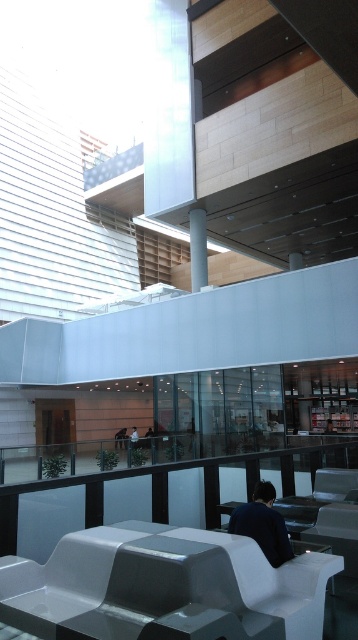
Question: Can you confirm if white glossy pillar at upper center is thinner than white fabric person at center?

Choices:
 (A) no
 (B) yes

Answer: (B)

Question: Is white glossy pillar at upper center positioned in front of white fabric person at center?

Choices:
 (A) no
 (B) yes

Answer: (A)

Question: Does white glossy pillar at upper center appear over white fabric person at center?

Choices:
 (A) no
 (B) yes

Answer: (B)

Question: Which point is closer to the camera taking this photo?

Choices:
 (A) (200, 248)
 (B) (273, 513)
 (C) (10, 593)

Answer: (C)

Question: Among these points, which one is nearest to the camera?

Choices:
 (A) [x=194, y=240]
 (B) [x=131, y=444]
 (C) [x=322, y=554]

Answer: (C)

Question: Which point is closer to the camera?

Choices:
 (A) white glossy pillar at upper center
 (B) white fabric person at center
 (C) white glossy bench at lower center

Answer: (C)